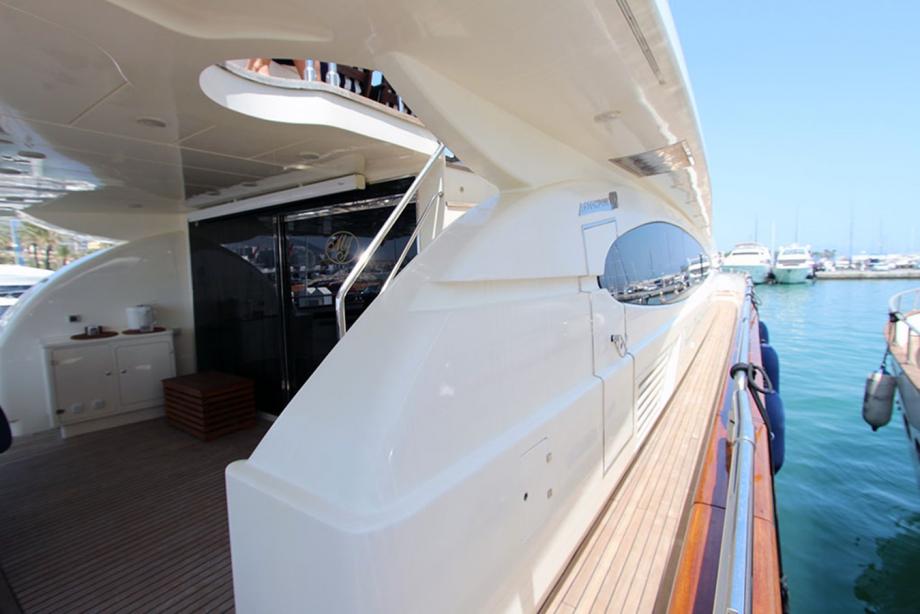
Locate an element on the screen. cabinet/dresser is located at coordinates (122, 357), (65, 373), (155, 344), (145, 391), (105, 400).